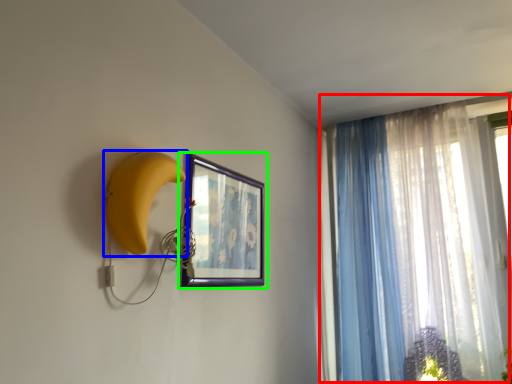
Question: Which object is positioned farthest from curtain (highlighted by a red box)? Select from banana (highlighted by a blue box) and picture frame (highlighted by a green box).

Choices:
 (A) banana
 (B) picture frame

Answer: (A)